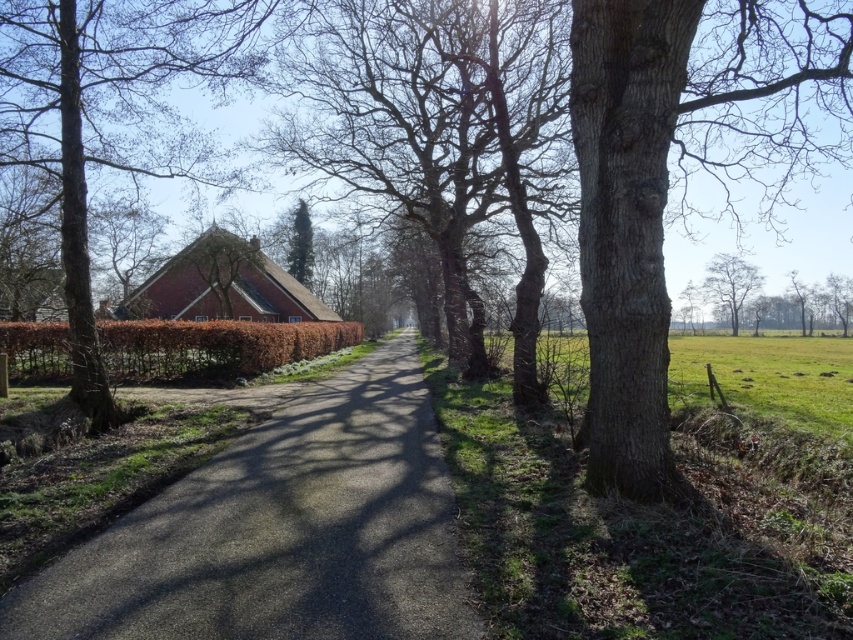
You are a photographer standing on the road and want to capture both the gray rough bark tree at right and the smooth bark tree at upper right in a single frame. Which tree should you focus on to ensure both are in the shot?

To capture both the gray rough bark tree at right and the smooth bark tree at upper right in a single frame, focus on the gray rough bark tree at right since it is positioned over the smooth bark tree at upper right, meaning it is closer to you.

Consider the image. You are a bird looking for a higher perch. You see the gray rough bark tree at right and the smooth bark tree at upper right. Which tree should you choose to get a higher vantage point?

The gray rough bark tree at right is taller than the smooth bark tree at upper right, so you should choose the gray rough bark tree at right to get a higher vantage point.

You are standing at the point with coordinates point (376, 33) and want to walk towards the point with coordinates point (271, 515). Which direction should you face to walk directly towards your destination?

You should face towards the direction where point (271, 515) is located, which is in front of point (376, 33). Since point (271, 515) is in front, you should face forward in the direction of the road leading towards it.